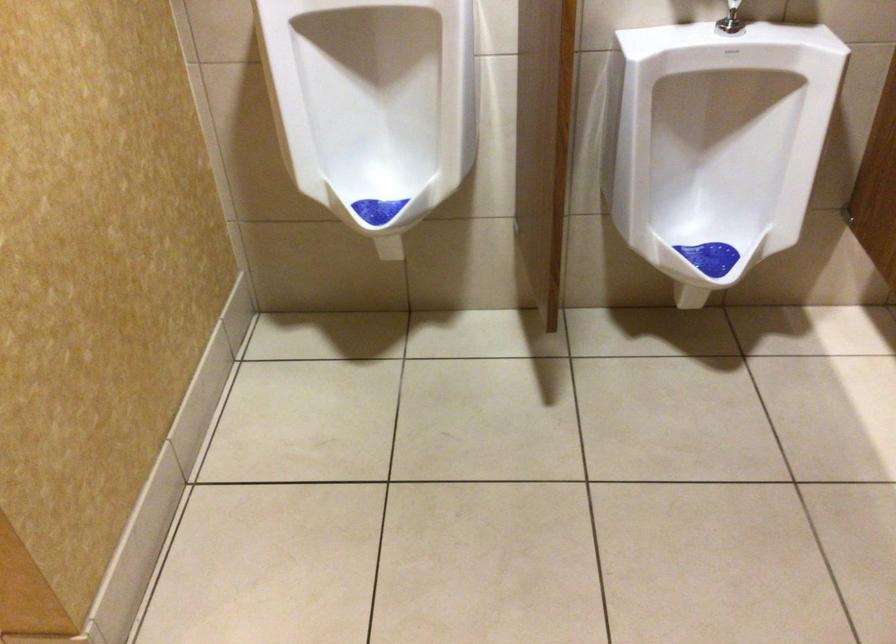
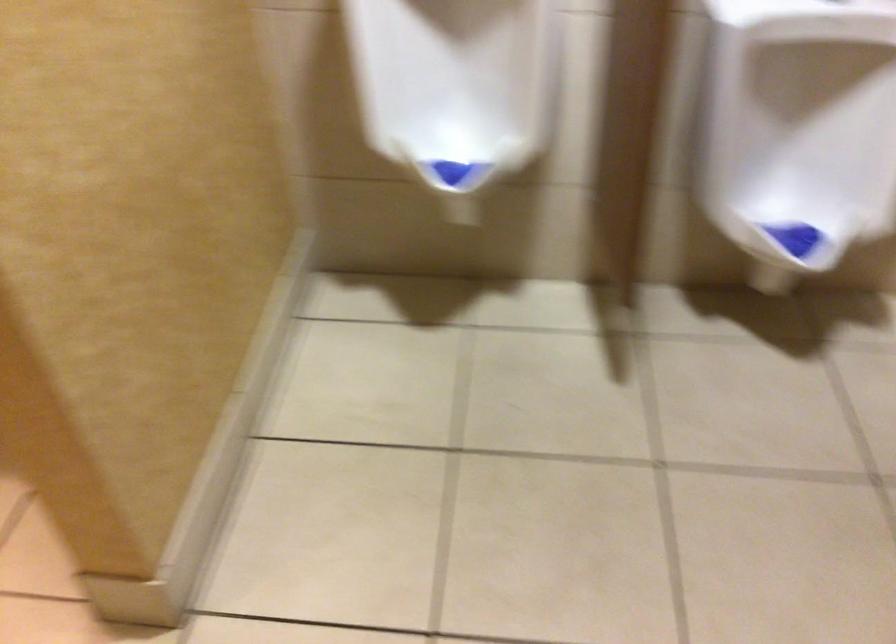
Question: Which direction would the cameraman need to move to produce the second image? Reply with the corresponding letter.

Choices:
 (A) Left
 (B) Right
 (C) Forward
 (D) Backward

Answer: (A)